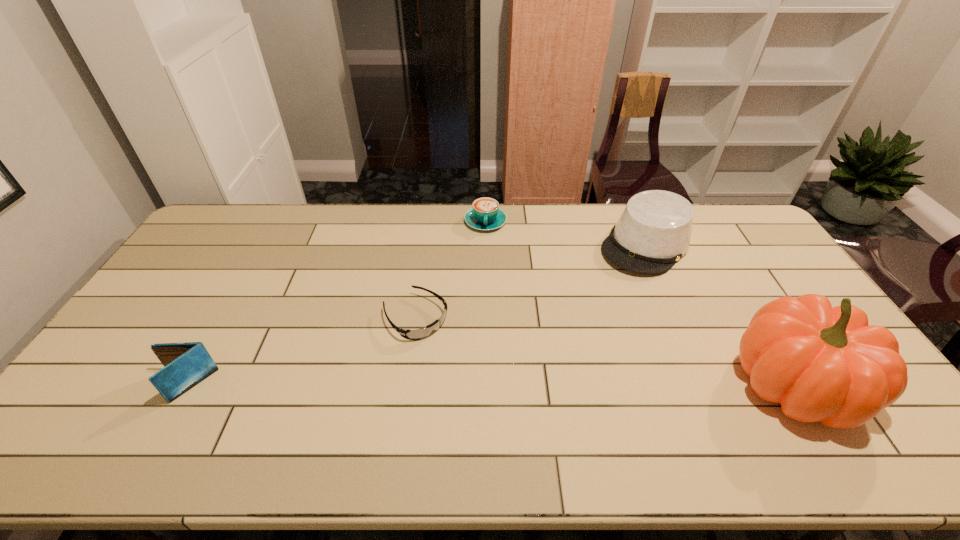
Locate an element on the screen. This screenshot has width=960, height=540. blank space located with the handle on the right side of the third object from right to left is located at coordinates pyautogui.click(x=485, y=250).

Identify the location of hat that is at the far edge. (653, 232).

You are a GUI agent. You are given a task and a screenshot of the screen. Output one action in this format:
    pyautogui.click(x=<x>, y=<y>)
    Task: Click on the cappuccino present at the far edge
    
    Given the screenshot: What is the action you would take?
    pyautogui.click(x=485, y=214)

Where is `wallet situated at the near edge`? Image resolution: width=960 pixels, height=540 pixels. wallet situated at the near edge is located at coordinates (186, 364).

Find the location of a particular element. The width and height of the screenshot is (960, 540). pumpkin present at the near edge is located at coordinates (825, 364).

The height and width of the screenshot is (540, 960). Identify the location of object that is at the right edge. (825, 364).

At what (x,y) coordinates should I click in order to perform the action: click on object located in the near right corner section of the desktop. Please return your answer as a coordinate pair (x, y). Looking at the image, I should click on (825, 364).

Locate an element on the screen. This screenshot has width=960, height=540. free region at the far edge of the desktop is located at coordinates (590, 228).

Find the location of a particular element. The width and height of the screenshot is (960, 540). vacant area at the near edge is located at coordinates (189, 403).

In the image, there is a desktop. Where is `vacant space at the left edge`? The width and height of the screenshot is (960, 540). vacant space at the left edge is located at coordinates (156, 330).